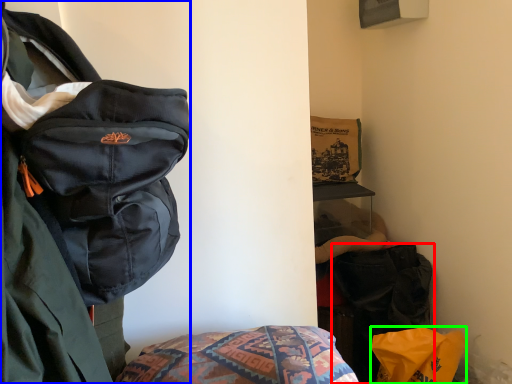
Question: Which object is the closest to the luggage and bags (highlighted by a red box)? Choose among these: backpack (highlighted by a blue box) or material (highlighted by a green box).

Choices:
 (A) backpack
 (B) material

Answer: (B)